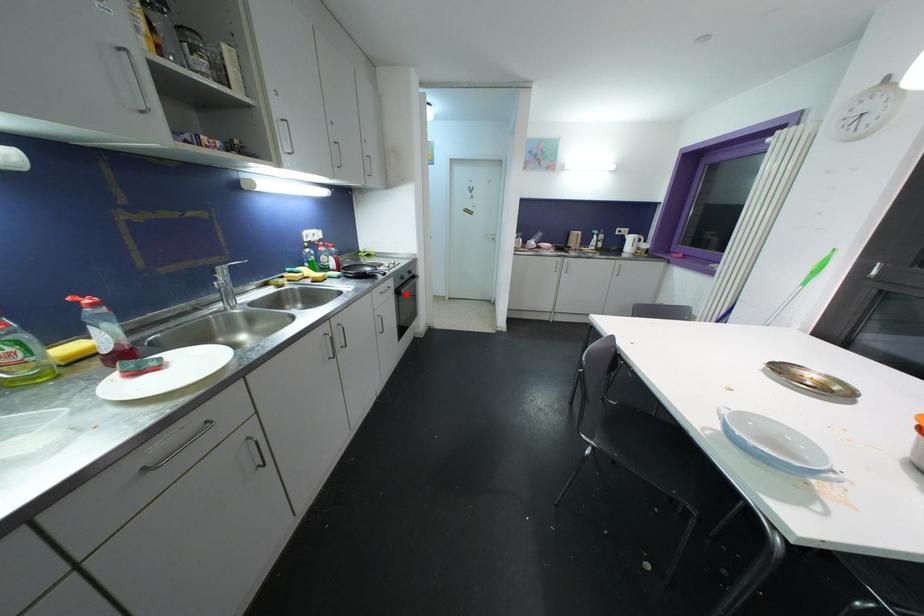
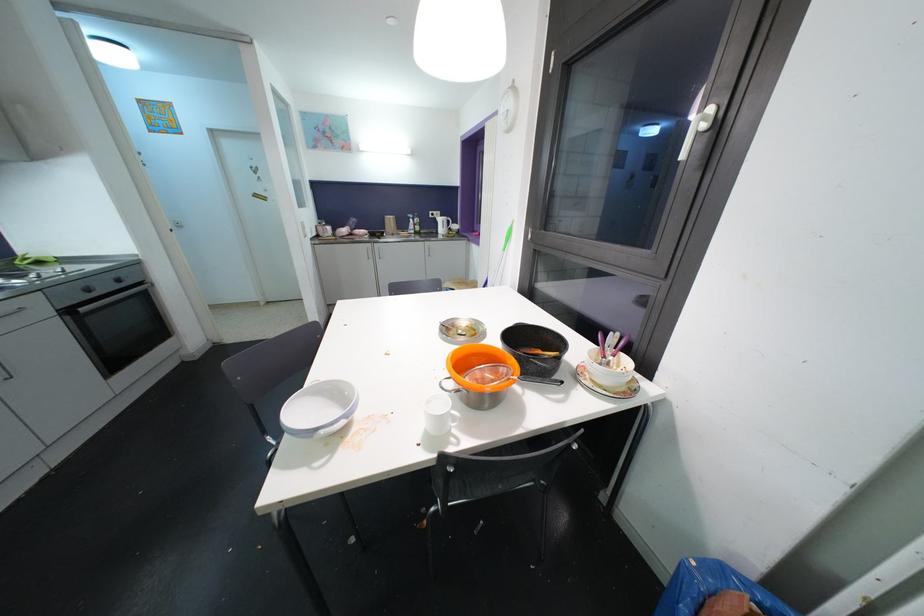
Question: I am providing you with two images of the same scene from different viewpoints. Given a red point in image1, look at the same physical point in image2. Is it:

Choices:
 (A) Closer to the viewpoint
 (B) Farther from the viewpoint

Answer: (B)